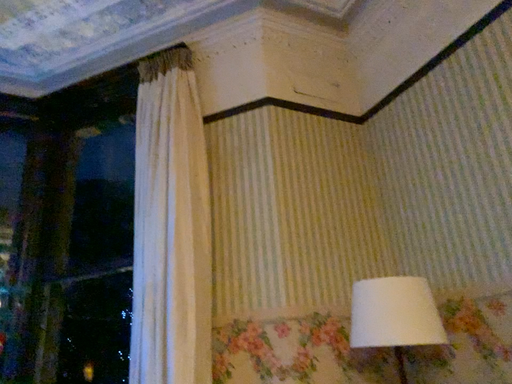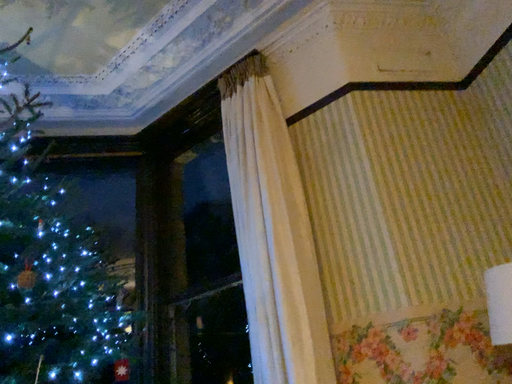
Question: Which way did the camera rotate in the video?

Choices:
 (A) rotated left
 (B) rotated right

Answer: (A)